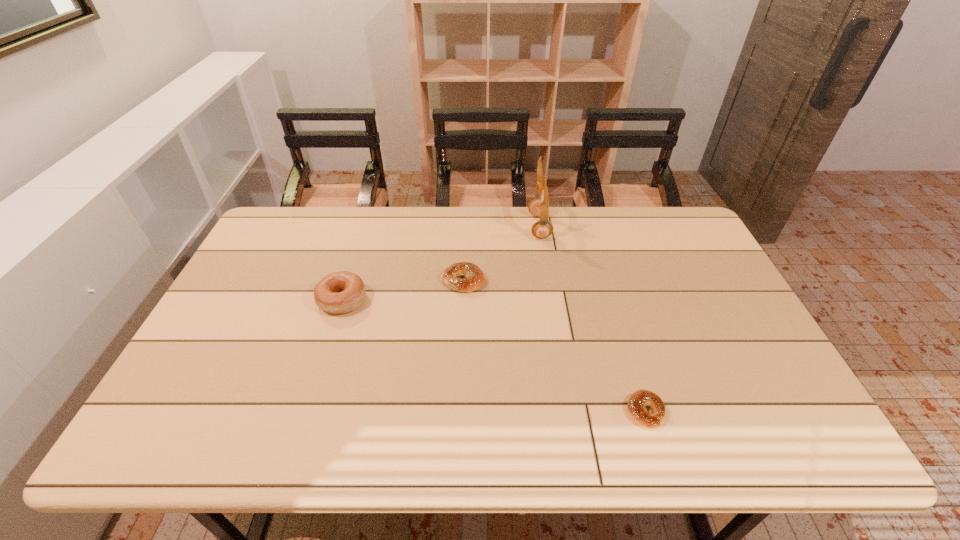
The height and width of the screenshot is (540, 960). Find the location of `empty space between the shortest bagel and the third shortest object`. empty space between the shortest bagel and the third shortest object is located at coordinates (494, 356).

In order to click on free space between the second object from left to right and the shortest bagel in this screenshot , I will do `click(554, 346)`.

Find the location of a particular element. object identified as the second closest to the rightmost bagel is located at coordinates (539, 207).

Identify which object is located as the third nearest to the leftmost object. Please provide its 2D coordinates. Your answer should be formatted as a tuple, i.e. [(x, y)], where the tuple contains the x and y coordinates of a point satisfying the conditions above.

[(639, 399)]

What are the coordinates of `bagel object that ranks as the second closest to the second tallest bagel` in the screenshot? It's located at (639, 399).

Select which bagel is the second closest to the second tallest object. Please provide its 2D coordinates. Your answer should be formatted as a tuple, i.e. [(x, y)], where the tuple contains the x and y coordinates of a point satisfying the conditions above.

[(639, 399)]

The image size is (960, 540). In order to click on free location that satisfies the following two spatial constraints: 1. on the back side of the second shortest object; 2. on the right side of the tallest bagel in this screenshot , I will do `click(348, 280)`.

Identify the location of free spot that satisfies the following two spatial constraints: 1. on the front-facing side of the third object from left to right; 2. on the back side of the rightmost object. (569, 411).

I want to click on free spot that satisfies the following two spatial constraints: 1. on the front-facing side of the tallest object; 2. on the left side of the rightmost bagel, so click(569, 411).

This screenshot has height=540, width=960. I want to click on vacant area that satisfies the following two spatial constraints: 1. on the front-facing side of the rightmost object; 2. on the right side of the second object from right to left, so (569, 411).